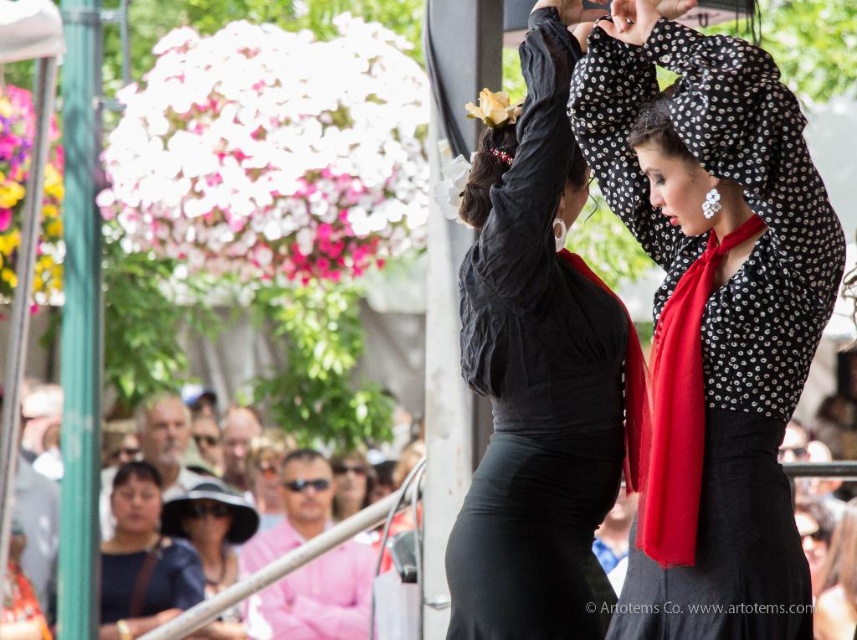
Question: Observing the image, what is the correct spatial positioning of black satin dress at center in reference to matte black sunglasses at lower center?

Choices:
 (A) above
 (B) below

Answer: (A)

Question: Which object appears farthest from the camera in this image?

Choices:
 (A) black satin skirt at center
 (B) matte black dress at lower left
 (C) matte black sunglasses at lower center
 (D) polka dot blouse at center

Answer: (B)

Question: Can you confirm if matte black dress at lower left is smaller than black satin skirt at center?

Choices:
 (A) yes
 (B) no

Answer: (A)

Question: Does black satin skirt at center appear over matte black sunglasses at lower center?

Choices:
 (A) no
 (B) yes

Answer: (B)

Question: Which of the following is the closest to the observer?

Choices:
 (A) (382, 513)
 (B) (202, 588)
 (C) (496, 344)

Answer: (C)

Question: Estimate the real-world distances between objects in this image. Which object is farther from the matte black dress at lower left?

Choices:
 (A) black satin skirt at center
 (B) black satin dress at center
 (C) matte black sunglasses at lower center
 (D) polka dot blouse at center

Answer: (D)